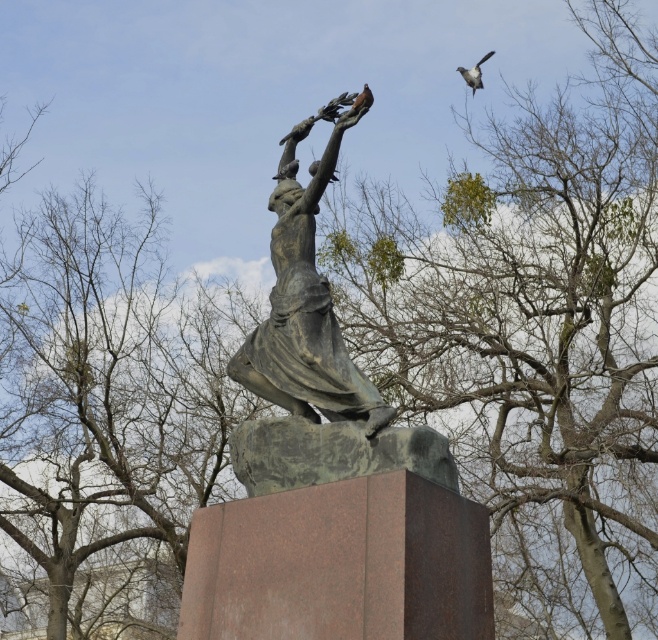
Which is more to the right, green mossy tree at upper center or gray feathered bird at upper right?

Positioned to the right is green mossy tree at upper center.

Is point (617, 604) farther from camera compared to point (476, 61)?

No, it is in front of (476, 61).

Is point (517, 540) positioned before point (476, 84)?

No, (517, 540) is further to viewer.

Find the location of a particular element. green mossy tree at upper center is located at coordinates (534, 333).

Between bare branches at center and bronze statue at center, which one appears on the right side from the viewer's perspective?

bronze statue at center

Is bare branches at center closer to the viewer compared to bronze statue at center?

Result: No.

Does point (82, 490) come behind point (286, 352)?

That is True.

Where is `bare branches at center`? The image size is (658, 640). bare branches at center is located at coordinates (107, 417).

From the picture: Can you confirm if green mossy tree at upper center is positioned below bare branches at center?

Actually, green mossy tree at upper center is above bare branches at center.

Is green mossy tree at upper center positioned at the back of bare branches at center?

No.

The image size is (658, 640). In order to click on green mossy tree at upper center in this screenshot , I will do `click(534, 333)`.